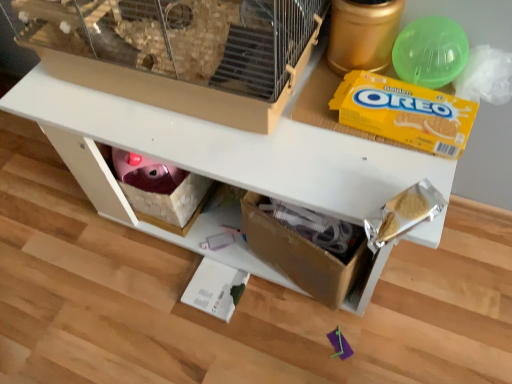
Question: Considering the relative positions of yellow cardboard oreo at upper right and white matte table at center in the image provided, is yellow cardboard oreo at upper right to the left or to the right of white matte table at center?

Choices:
 (A) right
 (B) left

Answer: (A)

Question: Considering the positions of point 420,117 and point 178,132, is point 420,117 closer or farther from the camera than point 178,132?

Choices:
 (A) farther
 (B) closer

Answer: (B)

Question: Which is nearer to the white matte table at center?

Choices:
 (A) yellow cardboard oreo at upper right
 (B) green plastic ball at upper right
 (C) beige plastic bird cage at upper center

Answer: (C)

Question: Estimate the real-world distances between objects in this image. Which object is closer to the yellow cardboard oreo at upper right?

Choices:
 (A) beige plastic bird cage at upper center
 (B) green plastic ball at upper right
 (C) white matte table at center

Answer: (B)